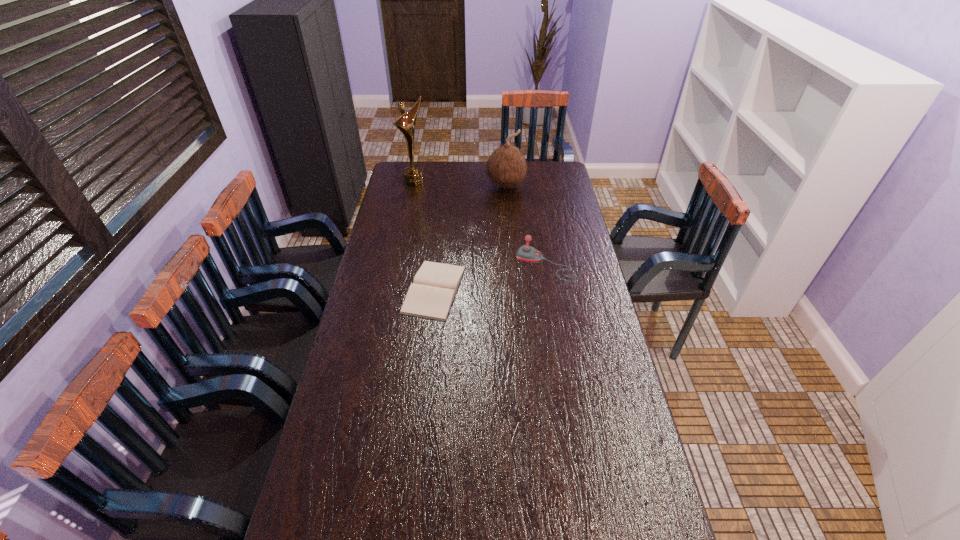
At what (x,y) coordinates should I click in order to perform the action: click on vacant space at the left edge of the desktop. Please return your answer as a coordinate pair (x, y). Image resolution: width=960 pixels, height=540 pixels. Looking at the image, I should click on (396, 286).

Image resolution: width=960 pixels, height=540 pixels. In the image, there is a desktop. Identify the location of vacant area at the right edge. [x=612, y=470].

The image size is (960, 540). I want to click on vacant point at the far left corner, so click(x=396, y=182).

In the image, there is a desktop. Identify the location of vacant space at the near left corner. This screenshot has width=960, height=540. (304, 514).

What are the coordinates of `vacant area at the far right corner of the desktop` in the screenshot? It's located at (548, 167).

Where is `free spot between the third shortest object and the joystick`? free spot between the third shortest object and the joystick is located at coordinates (526, 225).

Locate an element on the screen. This screenshot has height=540, width=960. vacant area between the third shortest object and the award is located at coordinates (460, 184).

Locate an element on the screen. empty space between the joystick and the second tallest object is located at coordinates (526, 225).

Identify the location of empty space that is in between the coconut and the Bible. This screenshot has height=540, width=960. (470, 238).

Where is `free spot between the Bible and the second tallest object`? The width and height of the screenshot is (960, 540). free spot between the Bible and the second tallest object is located at coordinates (470, 238).